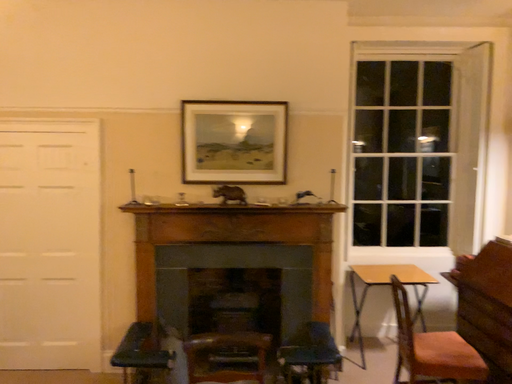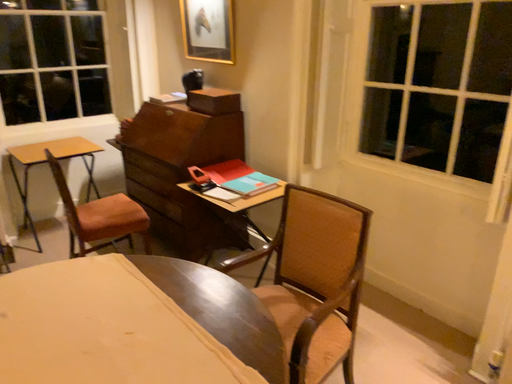
Question: How did the camera likely rotate when shooting the video?

Choices:
 (A) rotated downward
 (B) rotated upward

Answer: (A)